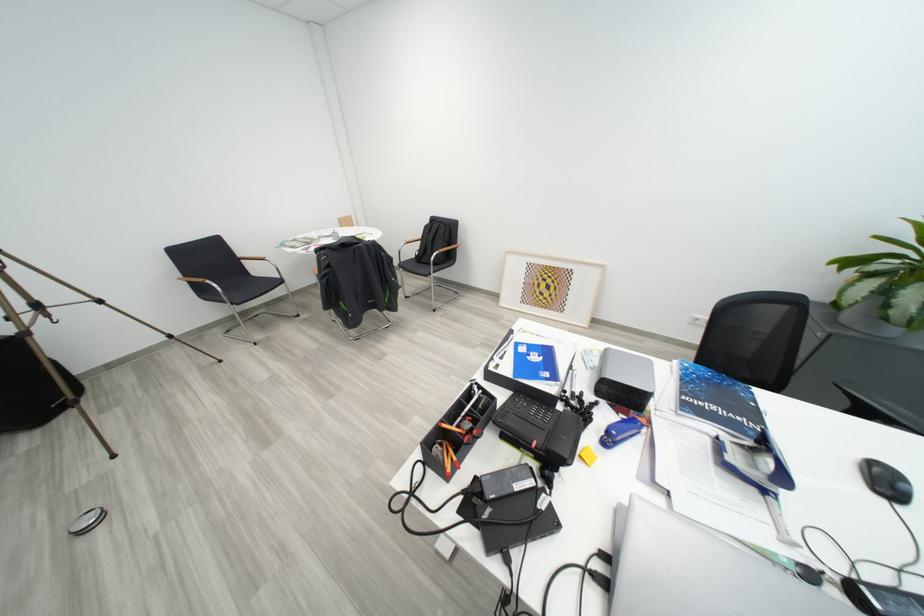
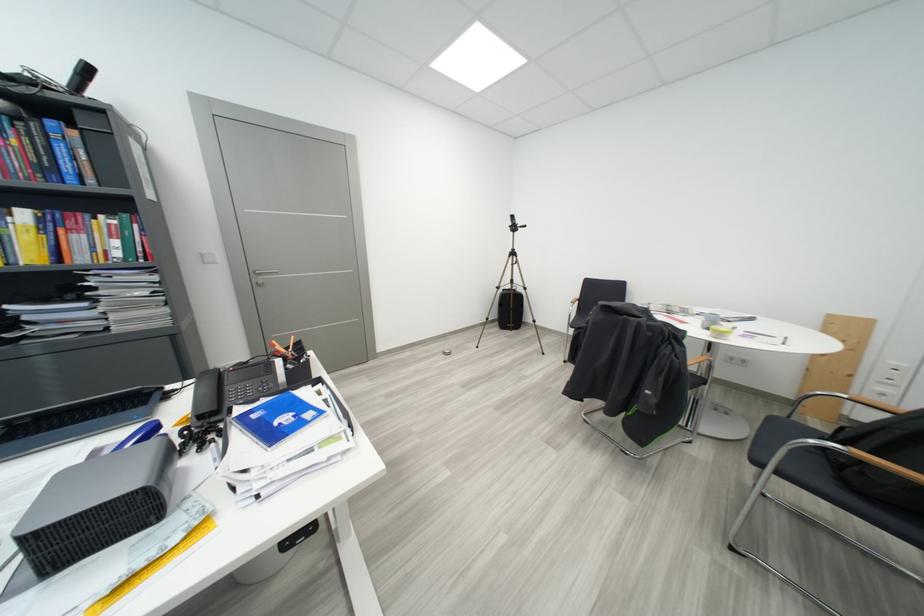
Where in the second image is the point corresponding to point 555,377 from the first image?

(263, 419)